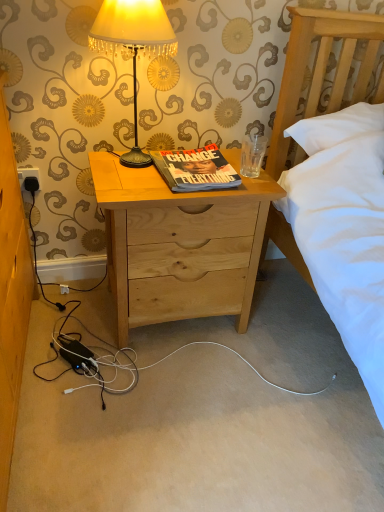
Question: Is natural wood nightstand at center spatially inside metallic lampshade at upper center, or outside of it?

Choices:
 (A) inside
 (B) outside

Answer: (B)

Question: Based on their positions, is natural wood nightstand at center located to the left or right of metallic lampshade at upper center?

Choices:
 (A) right
 (B) left

Answer: (A)

Question: Which of these objects is positioned farthest from the black plastic power outlet at lower left?

Choices:
 (A) metallic lampshade at upper center
 (B) natural wood nightstand at center
 (C) hardcover book at center

Answer: (B)

Question: Which object is the farthest from the natural wood nightstand at center?

Choices:
 (A) hardcover book at center
 (B) metallic lampshade at upper center
 (C) black plastic power outlet at lower left

Answer: (C)